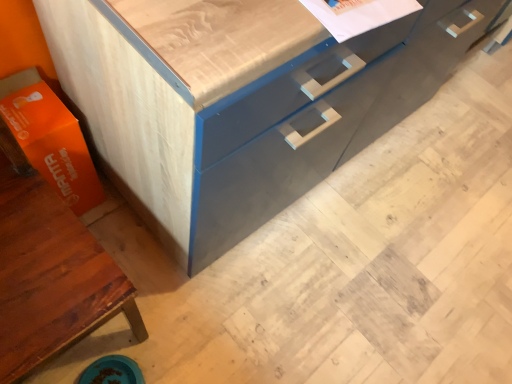
The image size is (512, 384). In order to click on empty space that is in between matte gray cabinet at center and orange matte cardboard box at lower left in this screenshot , I will do `click(132, 244)`.